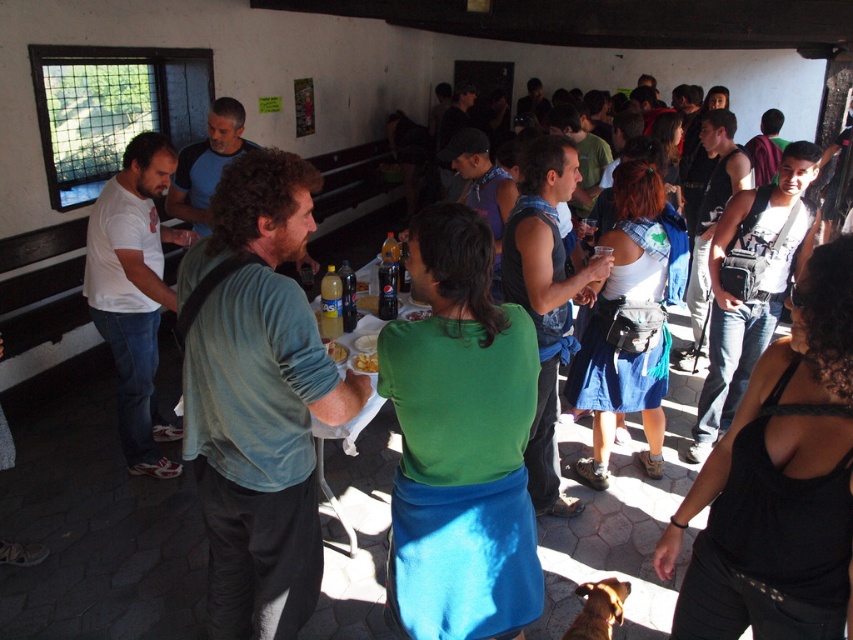
Does white cotton shirt at left have a greater height compared to brown furry dog at lower center?

Indeed, white cotton shirt at left has a greater height compared to brown furry dog at lower center.

Between white cotton shirt at left and brown furry dog at lower center, which one is positioned higher?

white cotton shirt at left is higher up.

Between point (86, 280) and point (589, 612), which one is positioned behind?

Point (86, 280)

At what (x,y) coordinates should I click in order to perform the action: click on white cotton shirt at left. Please return your answer as a coordinate pair (x, y). The height and width of the screenshot is (640, 853). Looking at the image, I should click on (134, 292).

Does yellow matte snack at center have a larger size compared to yellow matte plate at center?

Yes.

Locate an element on the screen. The height and width of the screenshot is (640, 853). yellow matte snack at center is located at coordinates (364, 362).

Locate an element on the screen. Image resolution: width=853 pixels, height=640 pixels. yellow matte snack at center is located at coordinates (364, 362).

In the scene shown: Between white cotton shirt at left and yellow matte plate at center, which one appears on the right side from the viewer's perspective?

Positioned to the right is yellow matte plate at center.

Does point (122, 221) come farther from viewer compared to point (335, 349)?

Yes.

Is point (160, 282) positioned in front of point (335, 346)?

No, it is behind (335, 346).

This screenshot has width=853, height=640. In order to click on white cotton shirt at left in this screenshot , I will do `click(134, 292)`.